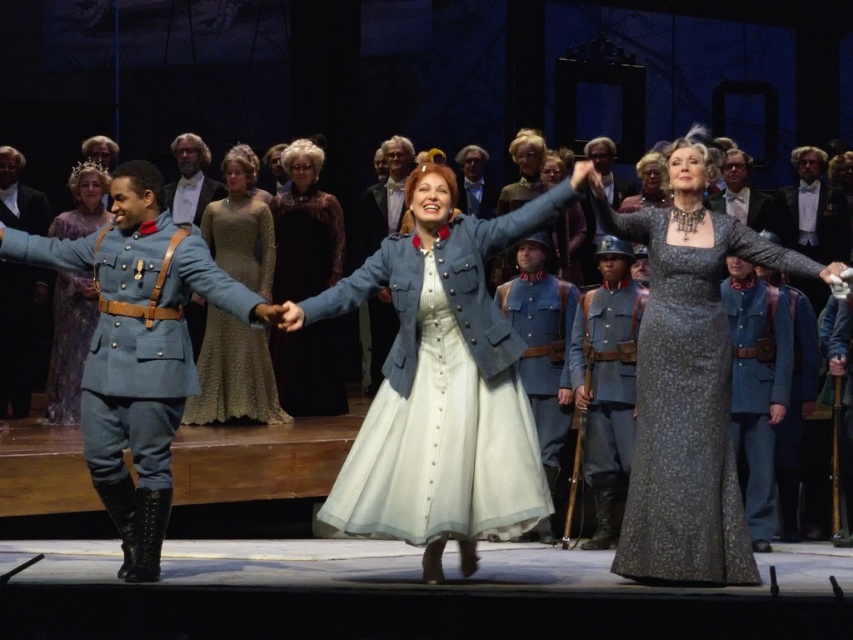
Question: Is matte blue dress at center thinner than light blue fabric uniform at center?

Choices:
 (A) yes
 (B) no

Answer: (A)

Question: Can you confirm if light blue fabric uniform at left is thinner than denim uniform at center?

Choices:
 (A) no
 (B) yes

Answer: (A)

Question: Can you confirm if velvet burgundy dress at center is positioned to the right of denim uniform at center?

Choices:
 (A) no
 (B) yes

Answer: (A)

Question: Estimate the real-world distances between objects in this image. Which object is closer to the velvet burgundy dress at center?

Choices:
 (A) light green lace dress at center
 (B) matte gray uniform at center
 (C) black leather jacket at left
 (D) denim jacket at center

Answer: (A)

Question: Among these points, which one is farthest from the camera?

Choices:
 (A) (488, 250)
 (B) (196, 152)
 (C) (103, 188)
 (D) (672, 499)

Answer: (B)

Question: Which of the following is the closest to the observer?

Choices:
 (A) (462, 561)
 (B) (325, 224)
 (C) (96, 216)
 (D) (613, 310)

Answer: (A)